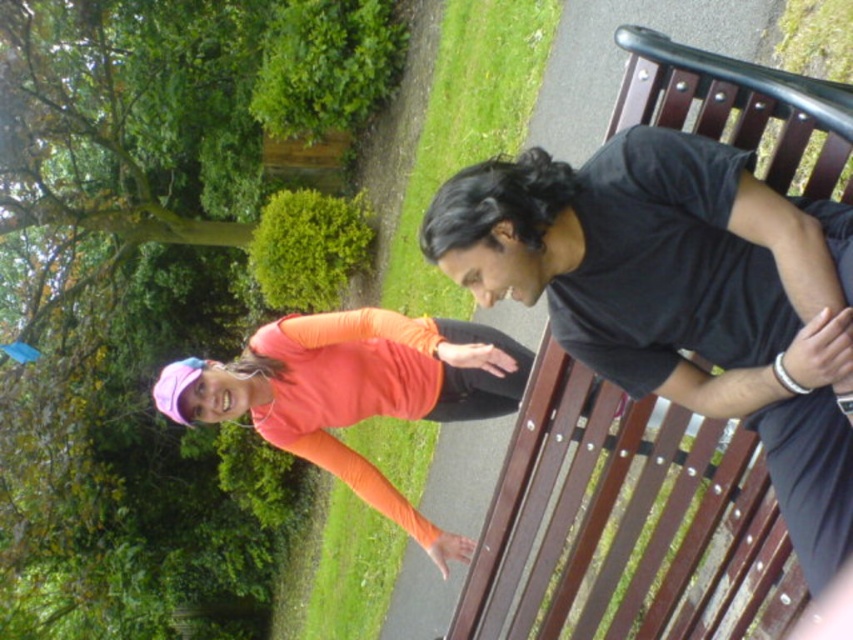
From the picture: Does brown wood bench at center appear over orange matte shirt at center?

Actually, brown wood bench at center is below orange matte shirt at center.

Who is positioned more to the left, brown wood bench at center or orange matte shirt at center?

From the viewer's perspective, orange matte shirt at center appears more on the left side.

Find the location of a particular element. brown wood bench at center is located at coordinates (735, 100).